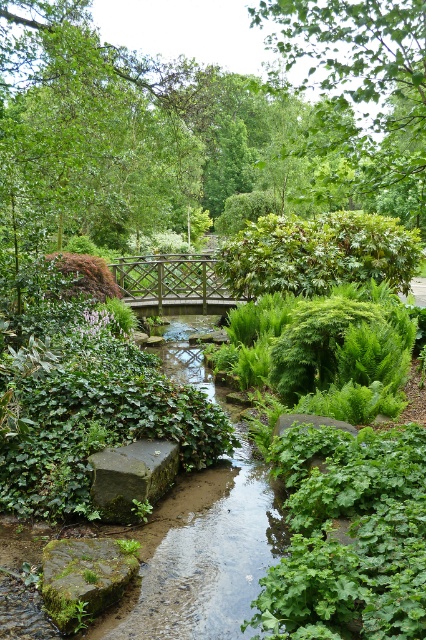
Is point (330, 97) in front of point (164, 298)?

Yes, point (330, 97) is closer to viewer.

Is point (379, 145) behind point (166, 305)?

No, it is not.

I want to click on green leafy tree at upper center, so click(359, 97).

How much distance is there between green leafy tree at upper center and green mossy stone at center?

24.76 feet

Can you confirm if green leafy tree at upper center is positioned to the left of green mossy stone at center?

In fact, green leafy tree at upper center is to the right of green mossy stone at center.

Who is more forward, (377,141) or (299,413)?

Positioned in front is point (377,141).

Where is `green leafy tree at upper center`? The image size is (426, 640). green leafy tree at upper center is located at coordinates (359, 97).

Which is in front, point (282, 45) or point (77, 589)?

Point (77, 589) is in front.

Is green leafy tree at upper center below green mossy rock at lower left?

Incorrect, green leafy tree at upper center is not positioned below green mossy rock at lower left.

What do you see at coordinates (359, 97) in the screenshot? I see `green leafy tree at upper center` at bounding box center [359, 97].

Identify the location of green leafy tree at upper center. The height and width of the screenshot is (640, 426). (359, 97).